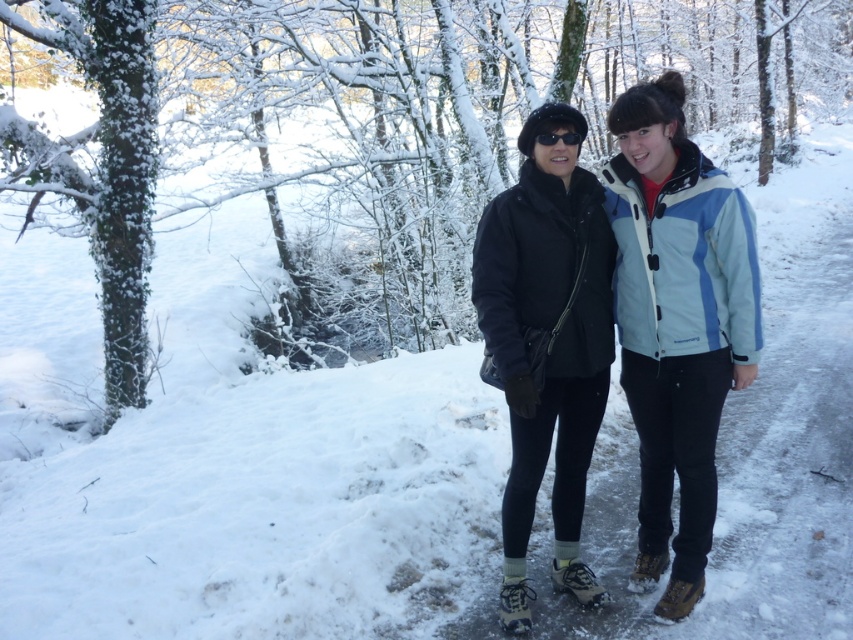
Question: Which object is farther from the camera taking this photo?

Choices:
 (A) white textured snowshoe at lower center
 (B) black matte jacket at center

Answer: (A)

Question: Is matte blue jacket at center further to the viewer compared to black matte goggles at center?

Choices:
 (A) yes
 (B) no

Answer: (B)

Question: Where is black matte jacket at center located in relation to black matte goggles at center in the image?

Choices:
 (A) right
 (B) left

Answer: (B)

Question: Which point is closer to the camera?

Choices:
 (A) (572, 136)
 (B) (625, 291)
 (C) (683, 588)
 (D) (572, 566)

Answer: (A)

Question: Among these points, which one is nearest to the camera?

Choices:
 (A) (521, 598)
 (B) (712, 182)
 (C) (683, 612)
 (D) (572, 486)

Answer: (B)

Question: Can you confirm if white textured snowshoe at lower center is wider than brown leather snowshoe at lower right?

Choices:
 (A) yes
 (B) no

Answer: (A)